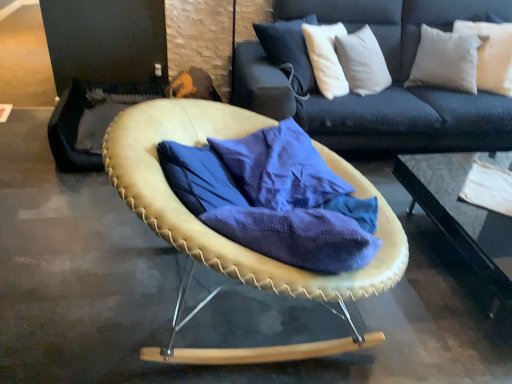
Question: From the image's perspective, is white soft pillow at upper right above or below transparent glass table at center?

Choices:
 (A) below
 (B) above

Answer: (B)

Question: Is white soft pillow at upper right taller or shorter than transparent glass table at center?

Choices:
 (A) short
 (B) tall

Answer: (B)

Question: Considering the real-world distances, which object is closest to the leather-like tan chair at center?

Choices:
 (A) transparent glass table at center
 (B) blue textured fabric at center
 (C) white soft pillow at upper right

Answer: (B)

Question: Considering the real-world distances, which object is farthest from the transparent glass table at center?

Choices:
 (A) blue textured fabric at center
 (B) white soft pillow at upper right
 (C) leather-like tan chair at center

Answer: (C)